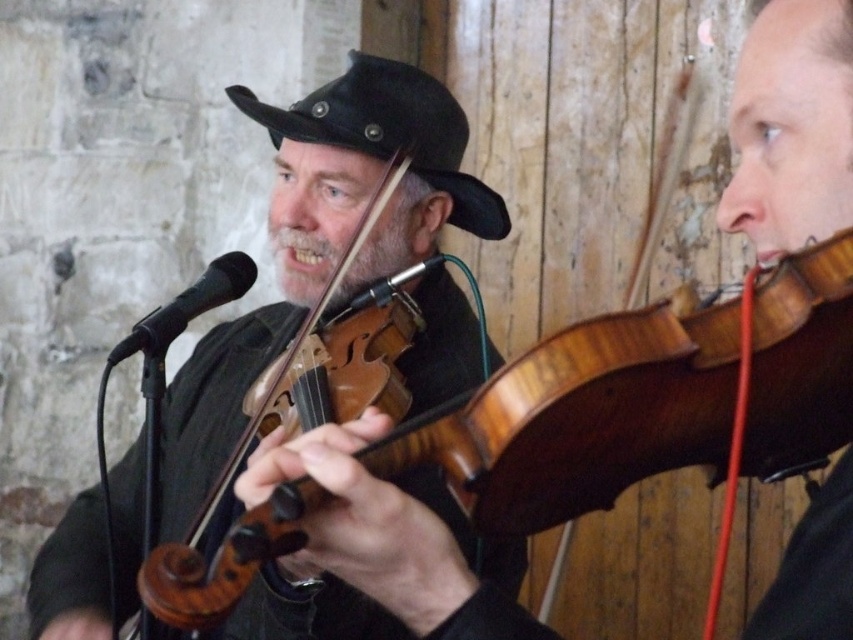
Which of these two, wooden violin at center or black leather hat at center, stands taller?

wooden violin at center

Is wooden violin at center above black leather hat at center?

Incorrect, wooden violin at center is not positioned above black leather hat at center.

You are a GUI agent. You are given a task and a screenshot of the screen. Output one action in this format:
    pyautogui.click(x=<x>, y=<y>)
    Task: Click on the wooden violin at center
    Image resolution: width=853 pixels, height=640 pixels.
    Given the screenshot: What is the action you would take?
    pyautogui.click(x=322, y=241)